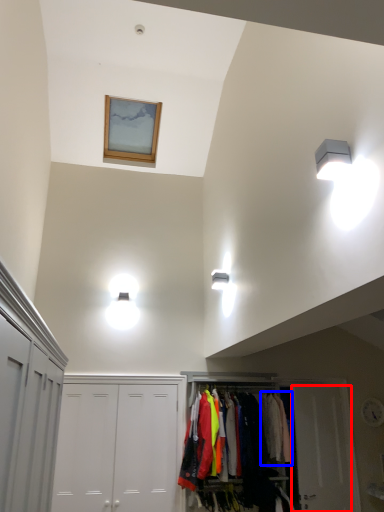
Question: Among these objects, which one is nearest to the camera, door (highlighted by a red box) or clothing (highlighted by a blue box)?

Choices:
 (A) door
 (B) clothing

Answer: (B)